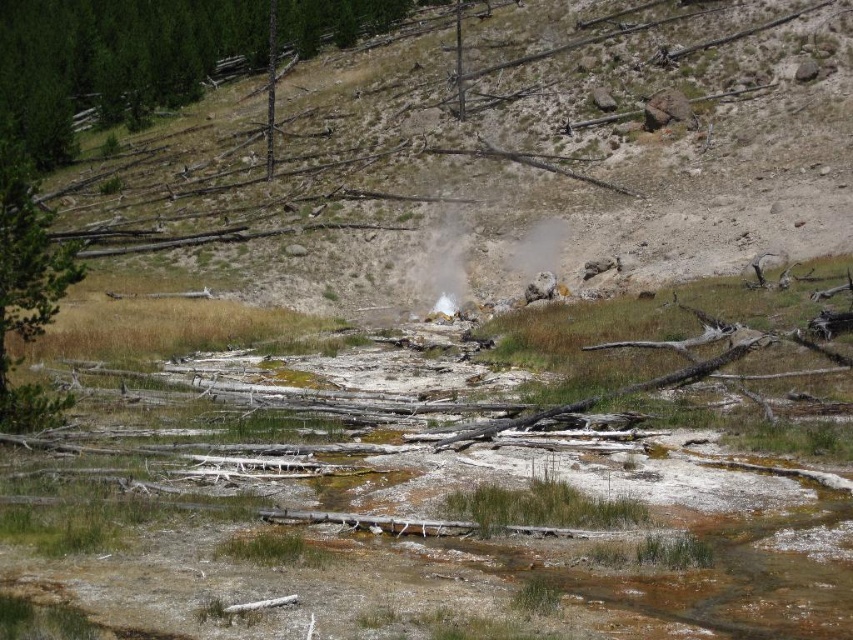
Does brown wood tree at upper left have a smaller size compared to green rough bark tree at left?

No.

Who is more forward, (73, 28) or (53, 394)?

Point (53, 394) is in front.

Locate an element on the screen. brown wood tree at upper left is located at coordinates (114, 60).

Is brown wood tree at upper left behind white vapor at center?

Yes.

The width and height of the screenshot is (853, 640). What do you see at coordinates (114, 60) in the screenshot?
I see `brown wood tree at upper left` at bounding box center [114, 60].

You are a GUI agent. You are given a task and a screenshot of the screen. Output one action in this format:
    pyautogui.click(x=<x>, y=<y>)
    Task: Click on the brown wood tree at upper left
    The height and width of the screenshot is (640, 853).
    Given the screenshot: What is the action you would take?
    pyautogui.click(x=114, y=60)

Which of these two, dull yellowish rock at center or white vapor at center, stands shorter?

With less height is white vapor at center.

Between point (663, 68) and point (450, 292), which one is positioned behind?

The point (663, 68) is more distant.

At what (x,y) coordinates should I click in order to perform the action: click on dull yellowish rock at center. Please return your answer as a coordinate pair (x, y). The height and width of the screenshot is (640, 853). Looking at the image, I should click on [x=502, y=150].